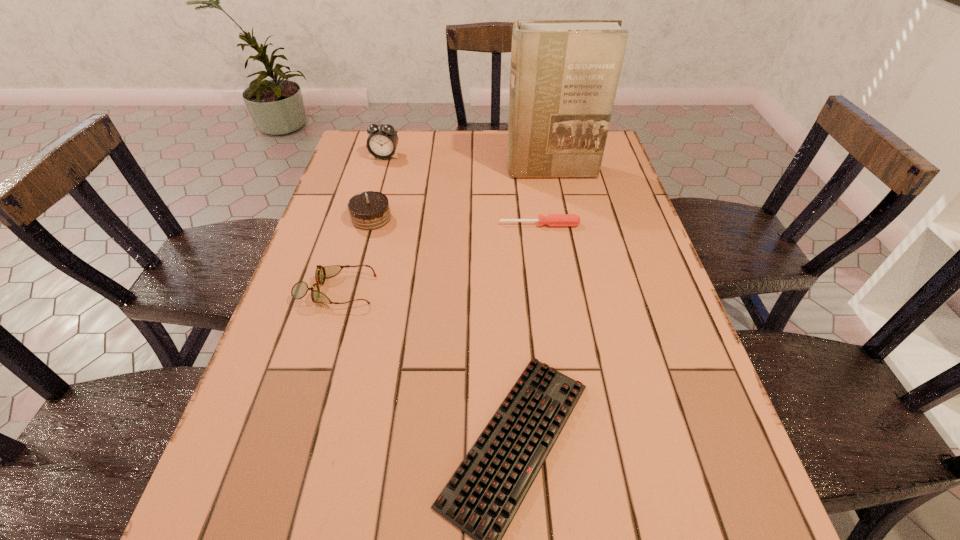
Image resolution: width=960 pixels, height=540 pixels. I want to click on phonebook, so click(x=564, y=74).

At what (x,y) coordinates should I click in order to perform the action: click on the fifth nearest object. Please return your answer as a coordinate pair (x, y). Image resolution: width=960 pixels, height=540 pixels. Looking at the image, I should click on (564, 74).

Find the location of a particular element. The width and height of the screenshot is (960, 540). the fifth shortest object is located at coordinates (382, 141).

The width and height of the screenshot is (960, 540). What are the coordinates of `alarm clock` in the screenshot? It's located at (382, 141).

Locate an element on the screen. The image size is (960, 540). the fourth shortest object is located at coordinates (369, 210).

Find the location of a particular element. the third shortest object is located at coordinates (299, 290).

You are a GUI agent. You are given a task and a screenshot of the screen. Output one action in this format:
    pyautogui.click(x=<x>, y=<y>)
    Task: Click on the fifth farthest object
    The width and height of the screenshot is (960, 540).
    Given the screenshot: What is the action you would take?
    pyautogui.click(x=299, y=290)

Image resolution: width=960 pixels, height=540 pixels. I want to click on the second shortest object, so click(552, 220).

Locate an element on the screen. The width and height of the screenshot is (960, 540). vacant space located on the cover of the tallest object is located at coordinates (560, 215).

This screenshot has height=540, width=960. What are the coordinates of `free location located on the front side of the alarm clock` in the screenshot? It's located at (377, 181).